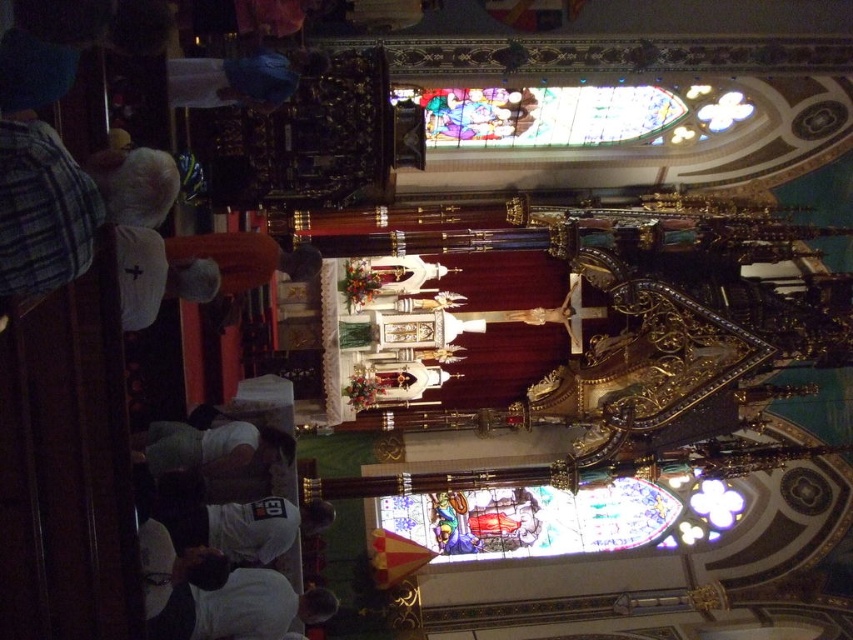
You are attending a service in the church and want to see both the stained glass at upper center and the white porcelain statue at center. Which one is positioned higher in the image?

The stained glass at upper center is located above the white porcelain statue at center, so it is positioned higher in the image.

You are attending a service in the church and notice two items of interest. The stained glass at upper center and the white fabric at lower center. Which of these two items is positioned to the right of the other?

The stained glass at upper center is positioned to the right of the white fabric at lower center.